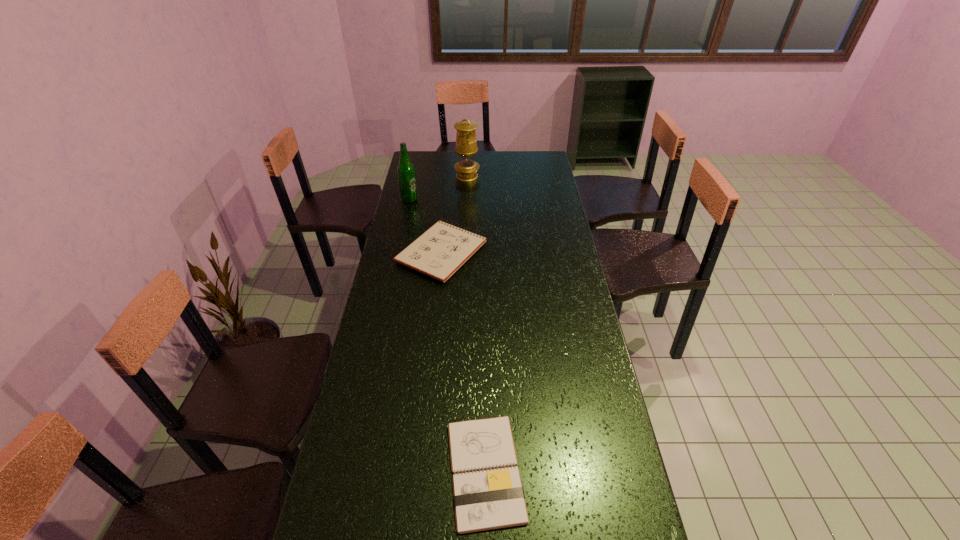
The image size is (960, 540). In order to click on free space that is in between the beer bottle and the oil lamp in this screenshot , I will do `click(439, 188)`.

Find the location of a particular element. vacant area that lies between the farthest object and the third tallest object is located at coordinates (455, 214).

Image resolution: width=960 pixels, height=540 pixels. I want to click on vacant space that's between the farther notepad and the shorter notepad, so click(464, 361).

At what (x,y) coordinates should I click in order to perform the action: click on free space between the second shortest object and the shortest object. Please return your answer as a coordinate pair (x, y). The image size is (960, 540). Looking at the image, I should click on (464, 361).

This screenshot has height=540, width=960. I want to click on free space between the second shortest object and the oil lamp, so click(455, 214).

This screenshot has width=960, height=540. What are the coordinates of `free spot between the nearest object and the farther notepad` in the screenshot? It's located at pos(464,361).

At what (x,y) coordinates should I click in order to perform the action: click on vacant area that lies between the shortest object and the third nearest object. Please return your answer as a coordinate pair (x, y). Looking at the image, I should click on (447, 335).

Identify which object is the closest to the third farthest object. Please provide its 2D coordinates. Your answer should be formatted as a tuple, i.e. [(x, y)], where the tuple contains the x and y coordinates of a point satisfying the conditions above.

[(406, 172)]

Identify which object is the nearest to the farther notepad. Please provide its 2D coordinates. Your answer should be formatted as a tuple, i.e. [(x, y)], where the tuple contains the x and y coordinates of a point satisfying the conditions above.

[(406, 172)]

This screenshot has width=960, height=540. I want to click on vacant space that satisfies the following two spatial constraints: 1. on the label of the beer bottle; 2. on the left side of the second nearest object, so click(398, 252).